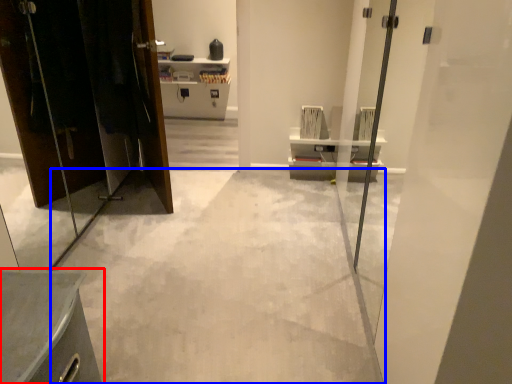
Question: Which object is closer to the camera taking this photo, furniture (highlighted by a red box) or concrete (highlighted by a blue box)?

Choices:
 (A) furniture
 (B) concrete

Answer: (A)